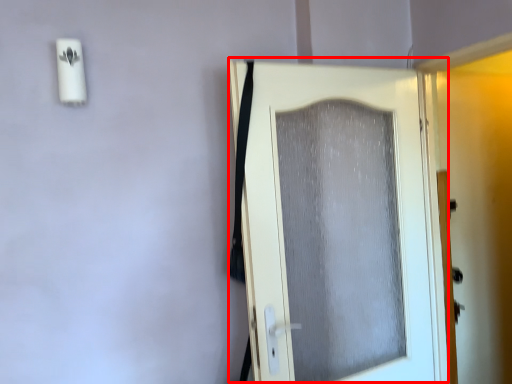
Question: Observing the image, what is the correct spatial positioning of door (annotated by the red box) in reference to screen door?

Choices:
 (A) left
 (B) right

Answer: (A)